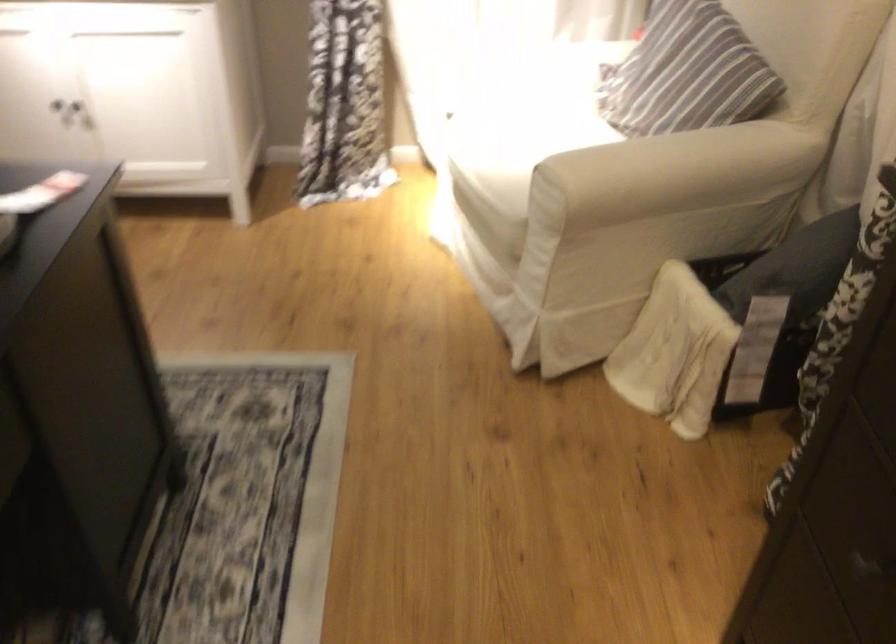
Where would you resting arm the chair armrest? Please return your answer as a coordinate pair (x, y).

(669, 169)